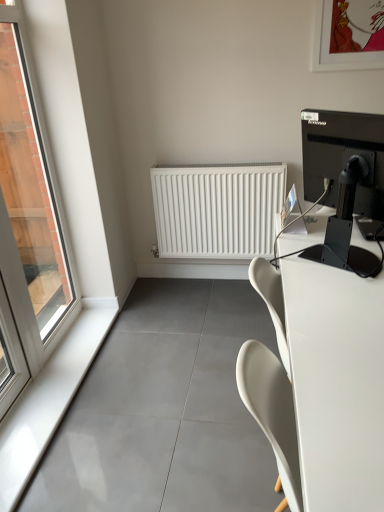
Question: Is white matte radiator at center situated inside white glossy window sill at left or outside?

Choices:
 (A) outside
 (B) inside

Answer: (A)

Question: Considering the positions of white matte radiator at center and white glossy window sill at left in the image, is white matte radiator at center wider or thinner than white glossy window sill at left?

Choices:
 (A) wide
 (B) thin

Answer: (B)

Question: Based on their relative distances, which object is farther from the white glossy window sill at left?

Choices:
 (A) clear glass window at left
 (B) white matte radiator at center
 (C) white glossy desk at right
 (D) black glossy monitor at upper right

Answer: (D)

Question: Which object is positioned closest to the clear glass window at left?

Choices:
 (A) black glossy monitor at upper right
 (B) white matte radiator at center
 (C) white glossy desk at right
 (D) white glossy window sill at left

Answer: (D)